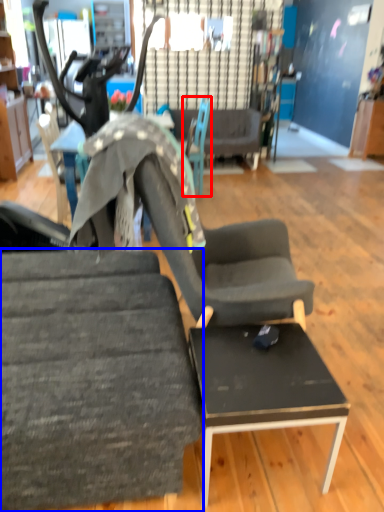
Question: Which point is further to the camera, chair (highlighted by a red box) or chair (highlighted by a blue box)?

Choices:
 (A) chair
 (B) chair

Answer: (A)